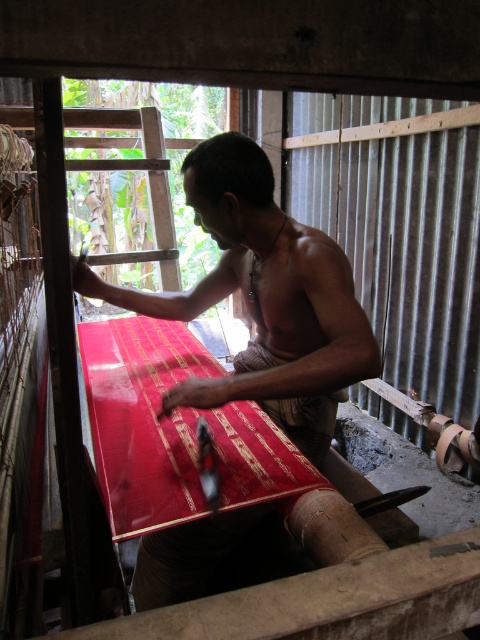
Question: Does shiny red fabric at center have a larger size compared to red silk fabric at center?

Choices:
 (A) no
 (B) yes

Answer: (B)

Question: Can you confirm if shiny red fabric at center is positioned to the right of red silk fabric at center?

Choices:
 (A) yes
 (B) no

Answer: (B)

Question: Which object is positioned closest to the shiny red fabric at center?

Choices:
 (A) smooth red fabric at center
 (B) red silk fabric at center

Answer: (B)

Question: Does smooth red fabric at center appear over shiny red fabric at center?

Choices:
 (A) no
 (B) yes

Answer: (B)

Question: Which object is positioned closest to the shiny red fabric at center?

Choices:
 (A) smooth red fabric at center
 (B) red silk fabric at center

Answer: (B)

Question: Which point is farther to the camera?

Choices:
 (A) (142, 563)
 (B) (104, 448)

Answer: (A)